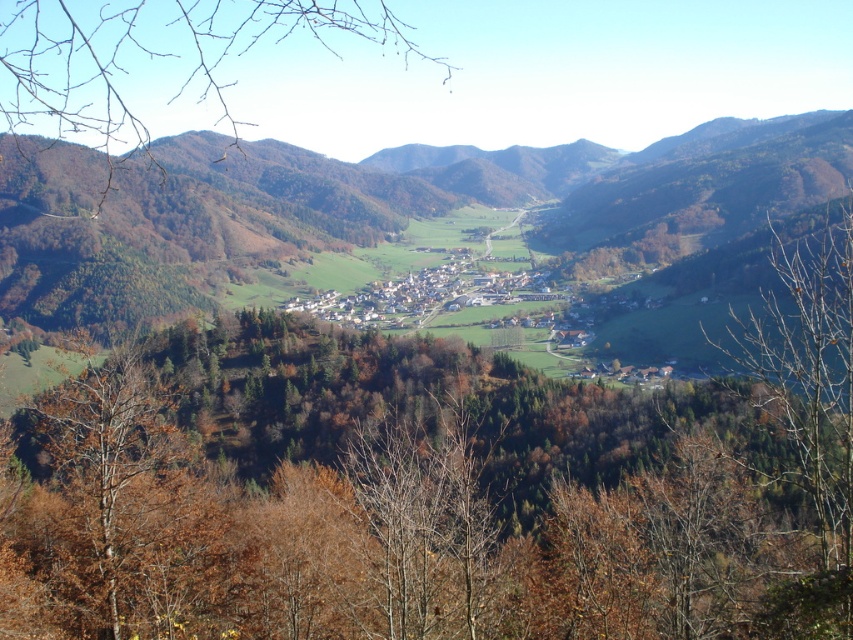
Question: Can you confirm if brown leafy tree at center is smaller than brown leafy tree at left?

Choices:
 (A) yes
 (B) no

Answer: (A)

Question: Does brown leafy tree at center lie behind brown leafy tree at left?

Choices:
 (A) no
 (B) yes

Answer: (B)

Question: Which point is farther to the camera?

Choices:
 (A) (393, 28)
 (B) (376, 432)

Answer: (A)

Question: Considering the relative positions of brown leafy tree at center and brown leafy tree at left in the image provided, where is brown leafy tree at center located with respect to brown leafy tree at left?

Choices:
 (A) right
 (B) left

Answer: (A)